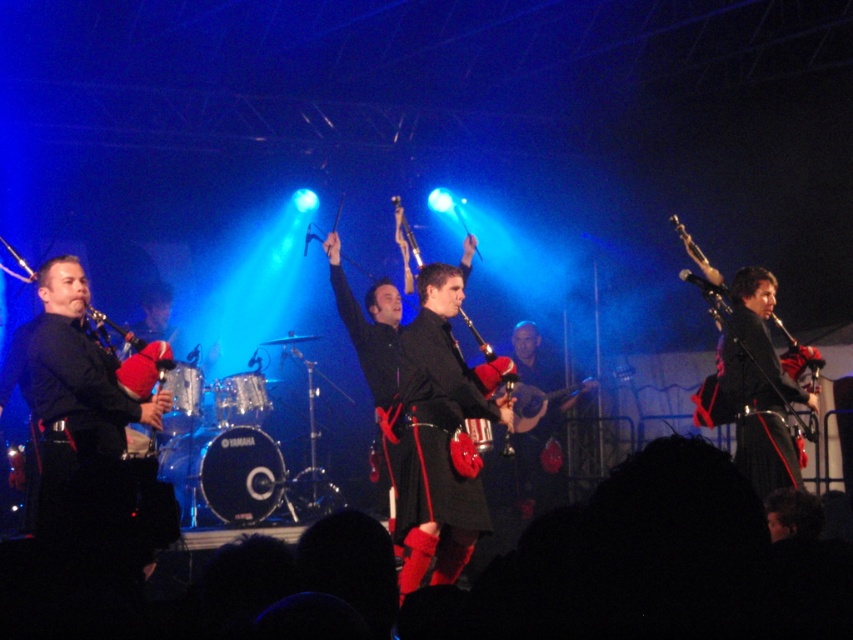
From the picture: You are a photographer at the front row of the concert. You want to capture a photo of the black leather kilt at center and the matte black bagpipes at center. Which one is positioned to the left of the other?

The black leather kilt at center is to the left of matte black bagpipes at center.

You are a photographer at the front row of the concert. You want to take a photo focusing on the black leather kilt at center and matte black bagpipes at center. Which object will appear larger in your photo?

The black leather kilt at center is closer to the viewer than matte black bagpipes at center, so it will appear larger in the photo.